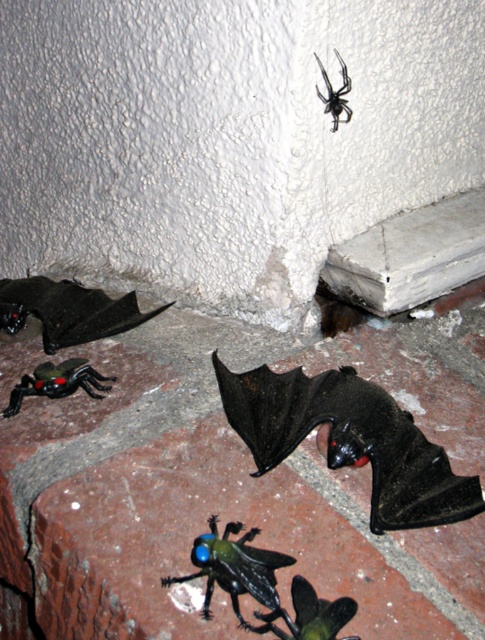
Question: Can you confirm if matte black bat at lower left is thinner than glossy plastic spider at lower left?

Choices:
 (A) yes
 (B) no

Answer: (B)

Question: Considering the relative positions of green glossy beetle at lower center and black matte spider at upper center in the image provided, where is green glossy beetle at lower center located with respect to black matte spider at upper center?

Choices:
 (A) above
 (B) below

Answer: (B)

Question: Which point appears closest to the camera in this image?

Choices:
 (A) (224, 404)
 (B) (292, 634)

Answer: (B)

Question: Which of the following is the closest to the observer?

Choices:
 (A) (318, 381)
 (B) (338, 616)
 (C) (349, 81)
 (D) (75, 388)

Answer: (B)

Question: Is black matte bat at lower center further to the viewer compared to glossy plastic spider at lower left?

Choices:
 (A) no
 (B) yes

Answer: (A)

Question: Which object is positioned farthest from the green glossy beetle at lower center?

Choices:
 (A) black matte bat at lower center
 (B) matte black bat at lower left

Answer: (B)